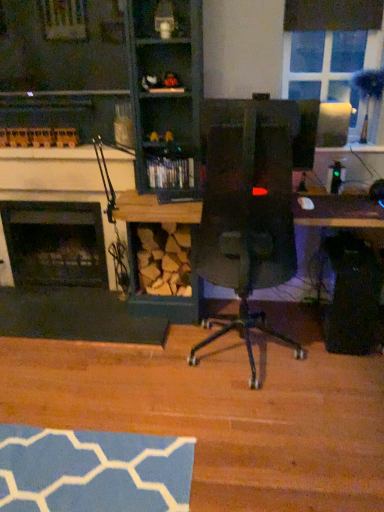
Where is `free space in front of wooden fireplace at left`? The image size is (384, 512). free space in front of wooden fireplace at left is located at coordinates (103, 404).